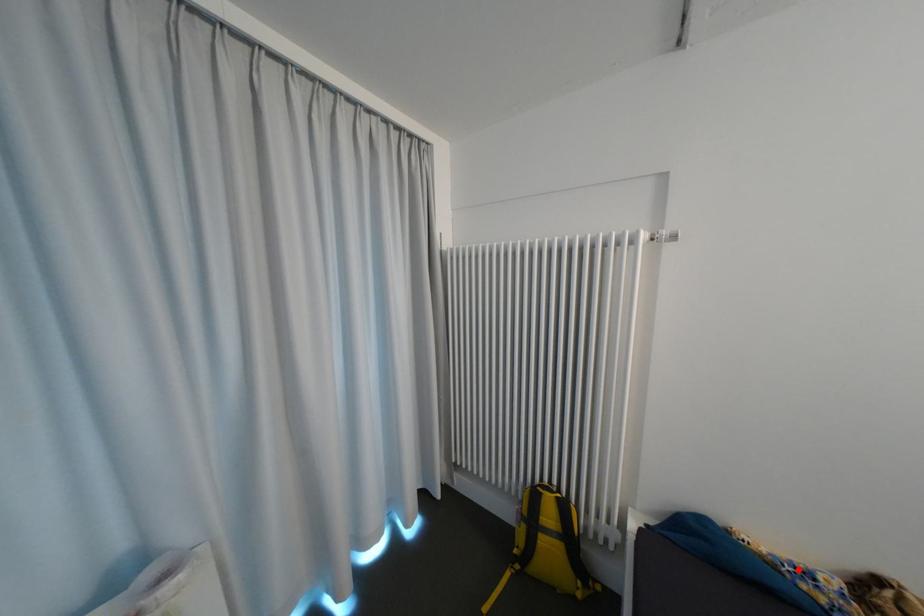
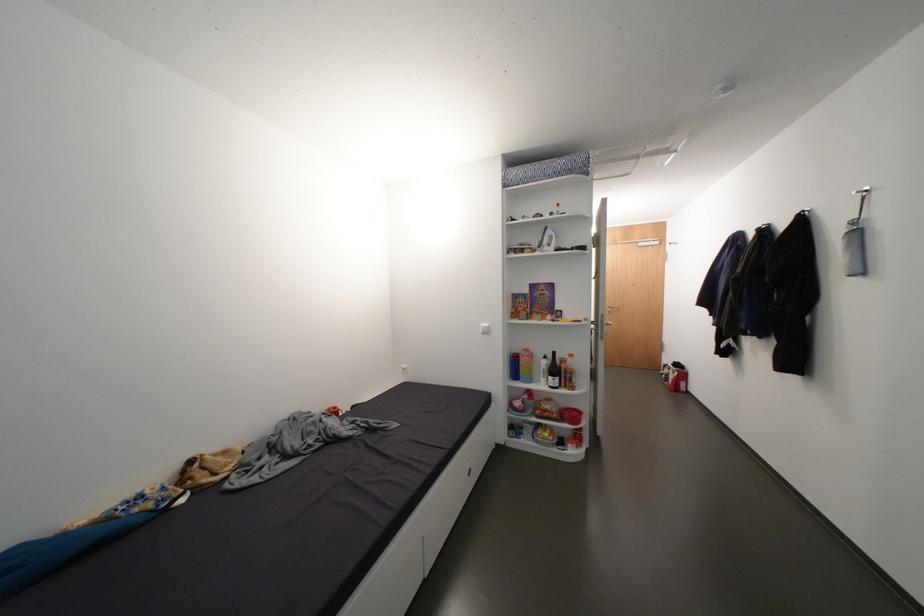
Locate, in the second image, the point that corresponds to the highlighted location in the first image.

(131, 508)